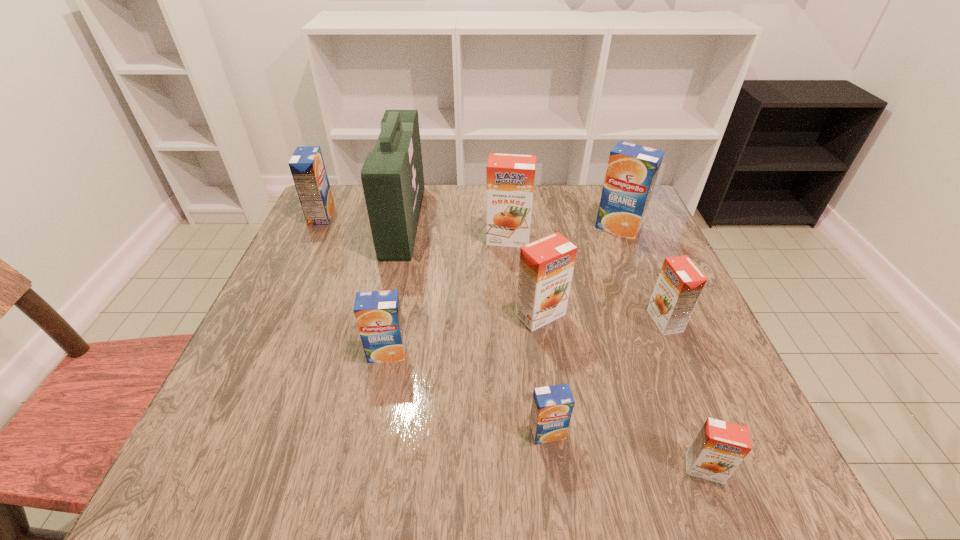
The width and height of the screenshot is (960, 540). In order to click on the closest object to the second nearest orange juice in this screenshot , I will do `click(718, 449)`.

Find the location of a particular element. This screenshot has height=540, width=960. the closest orange juice to the leftmost object is located at coordinates (510, 178).

The image size is (960, 540). I want to click on orange juice that stands as the fifth closest to the smallest blue orange_juice, so point(510,178).

Choose which orange orange juice is the third nearest neighbor to the leftmost orange juice. Please provide its 2D coordinates. Your answer should be formatted as a tuple, i.e. [(x, y)], where the tuple contains the x and y coordinates of a point satisfying the conditions above.

[(680, 283)]

Identify the location of orange orange juice that is the fourth closest to the smallest blue orange_juice. Image resolution: width=960 pixels, height=540 pixels. (510, 178).

Choose which blue orange_juice is the third nearest neighbor to the third biggest orange orange juice. Please provide its 2D coordinates. Your answer should be formatted as a tuple, i.e. [(x, y)], where the tuple contains the x and y coordinates of a point satisfying the conditions above.

[(378, 315)]

Locate which blue orange_juice ranks fourth in proximity to the third biggest orange orange juice. Please provide its 2D coordinates. Your answer should be formatted as a tuple, i.e. [(x, y)], where the tuple contains the x and y coordinates of a point satisfying the conditions above.

[(307, 167)]

Where is `vacant space that satisfies the following two spatial constraints: 1. on the front-facing side of the second blue orange_juice from left to right; 2. on the left side of the first-aid kit`? The height and width of the screenshot is (540, 960). vacant space that satisfies the following two spatial constraints: 1. on the front-facing side of the second blue orange_juice from left to right; 2. on the left side of the first-aid kit is located at coordinates (374, 353).

The image size is (960, 540). I want to click on blank space that satisfies the following two spatial constraints: 1. on the front-facing side of the tallest object; 2. on the back side of the third smallest orange orange juice, so click(383, 315).

The image size is (960, 540). Find the location of `free space that satisfies the following two spatial constraints: 1. on the back side of the third biggest orange orange juice; 2. on the right side of the smallest blue orange_juice`. free space that satisfies the following two spatial constraints: 1. on the back side of the third biggest orange orange juice; 2. on the right side of the smallest blue orange_juice is located at coordinates (534, 321).